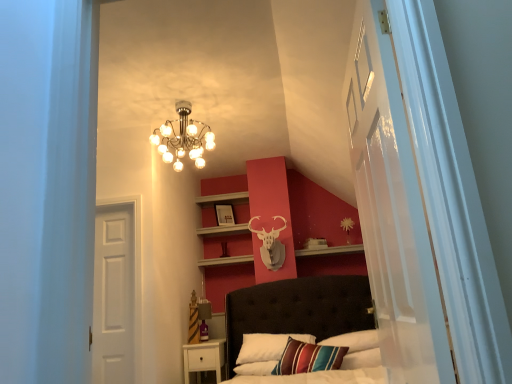
Question: Is the surface of metallic chandelier at upper center in direct contact with matte wooden picture frame at upper center?

Choices:
 (A) no
 (B) yes

Answer: (A)

Question: Does metallic chandelier at upper center come behind matte wooden picture frame at upper center?

Choices:
 (A) no
 (B) yes

Answer: (A)

Question: Considering the relative sizes of metallic chandelier at upper center and matte wooden picture frame at upper center in the image provided, is metallic chandelier at upper center bigger than matte wooden picture frame at upper center?

Choices:
 (A) yes
 (B) no

Answer: (A)

Question: Could you tell me if metallic chandelier at upper center is turned towards matte wooden picture frame at upper center?

Choices:
 (A) no
 (B) yes

Answer: (A)

Question: Does metallic chandelier at upper center have a lesser height compared to matte wooden picture frame at upper center?

Choices:
 (A) no
 (B) yes

Answer: (A)

Question: Looking at their shapes, would you say matte wooden picture frame at upper center is wider or thinner than transparent glass door at right?

Choices:
 (A) wide
 (B) thin

Answer: (B)

Question: Relative to transparent glass door at right, is matte wooden picture frame at upper center in front or behind?

Choices:
 (A) front
 (B) behind

Answer: (B)

Question: From the image's perspective, is matte wooden picture frame at upper center located above or below transparent glass door at right?

Choices:
 (A) below
 (B) above

Answer: (A)

Question: From a real-world perspective, is matte wooden picture frame at upper center positioned above or below transparent glass door at right?

Choices:
 (A) below
 (B) above

Answer: (B)

Question: Is metallic chandelier at upper center to the left or to the right of white matte door at left in the image?

Choices:
 (A) right
 (B) left

Answer: (A)

Question: From the image's perspective, relative to white matte door at left, is metallic chandelier at upper center above or below?

Choices:
 (A) below
 (B) above

Answer: (B)

Question: In terms of size, does metallic chandelier at upper center appear bigger or smaller than white matte door at left?

Choices:
 (A) big
 (B) small

Answer: (A)

Question: Is metallic chandelier at upper center wider or thinner than white matte door at left?

Choices:
 (A) thin
 (B) wide

Answer: (B)

Question: From the image's perspective, is white matte door at left located above or below transparent glass door at right?

Choices:
 (A) below
 (B) above

Answer: (A)

Question: Considering their positions, is white matte door at left located in front of or behind transparent glass door at right?

Choices:
 (A) front
 (B) behind

Answer: (B)